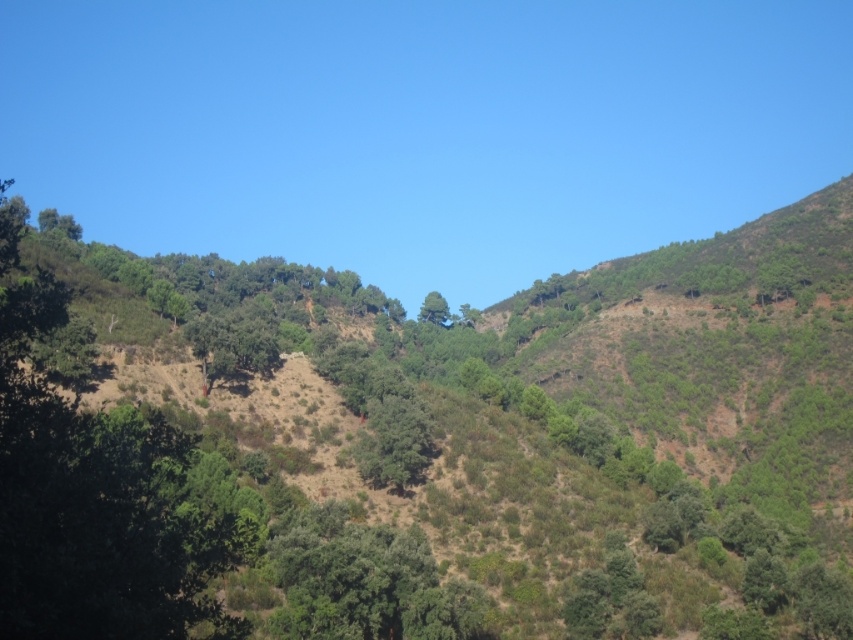
Question: Which of the following is the farthest from the observer?

Choices:
 (A) green matte tree at center
 (B) green leafy tree at center

Answer: (A)

Question: Is green leafy tree at center bigger than green matte tree at center?

Choices:
 (A) no
 (B) yes

Answer: (B)

Question: Considering the relative positions of green leafy tree at center and green matte tree at center in the image provided, where is green leafy tree at center located with respect to green matte tree at center?

Choices:
 (A) above
 (B) below

Answer: (B)

Question: Does green leafy tree at center come behind green matte tree at center?

Choices:
 (A) no
 (B) yes

Answer: (A)

Question: Which point is farther to the camera?

Choices:
 (A) (628, 477)
 (B) (436, 307)

Answer: (B)